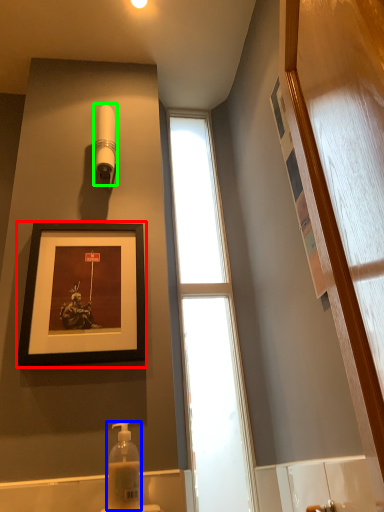
Question: Which is farther away from picture frame (highlighted by a red box)? soap dispenser (highlighted by a blue box) or shower (highlighted by a green box)?

Choices:
 (A) soap dispenser
 (B) shower

Answer: (B)